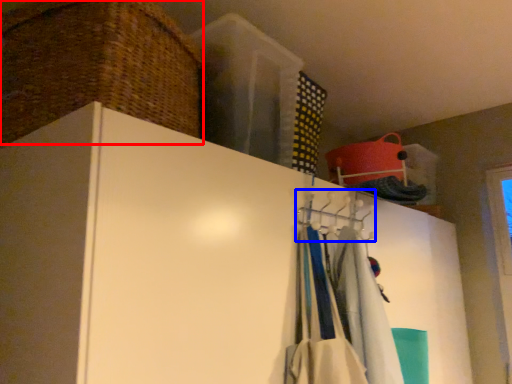
Question: Which object is closer to the camera taking this photo, basket (highlighted by a red box) or hanger (highlighted by a blue box)?

Choices:
 (A) basket
 (B) hanger

Answer: (A)